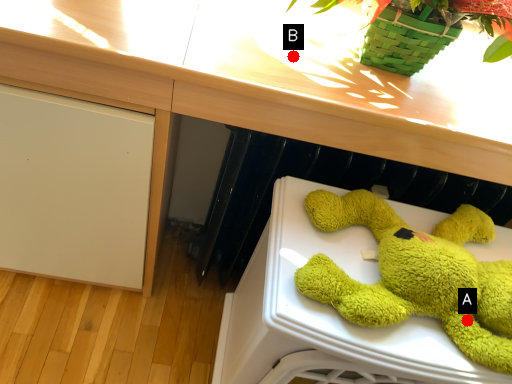
Question: Two points are circled on the image, labeled by A and B beside each circle. Which point is closer to the camera?

Choices:
 (A) A is closer
 (B) B is closer

Answer: (A)